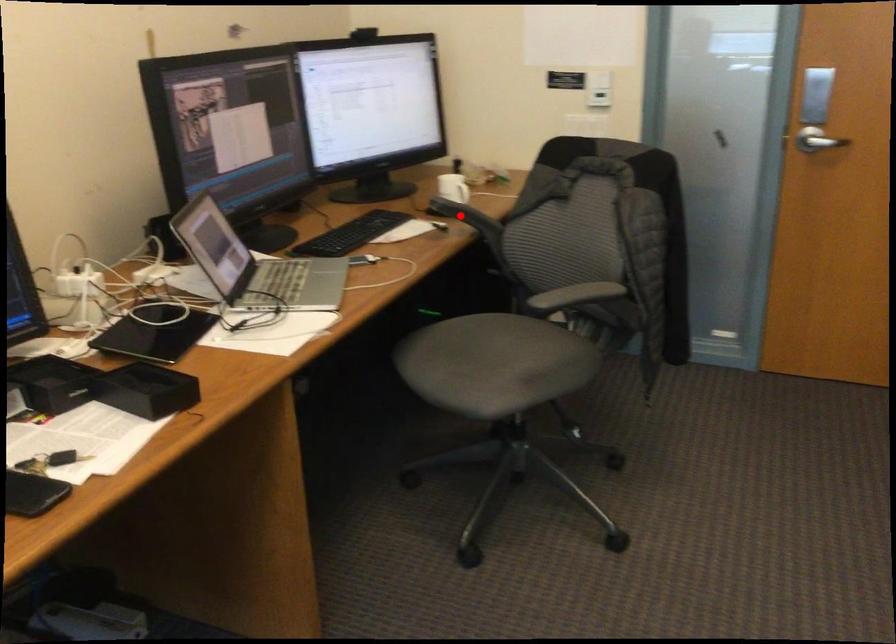
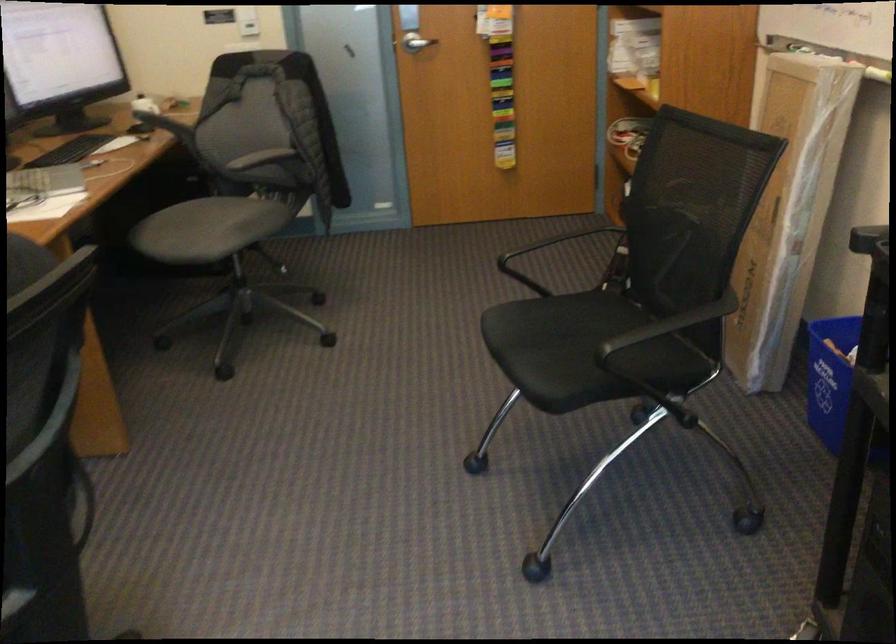
Question: I am providing you with two images of the same scene from different viewpoints. A red point is shown in image1. For the corresponding object point in image2, is it positioned nearer or farther from the camera?

Choices:
 (A) Nearer
 (B) Farther

Answer: (B)